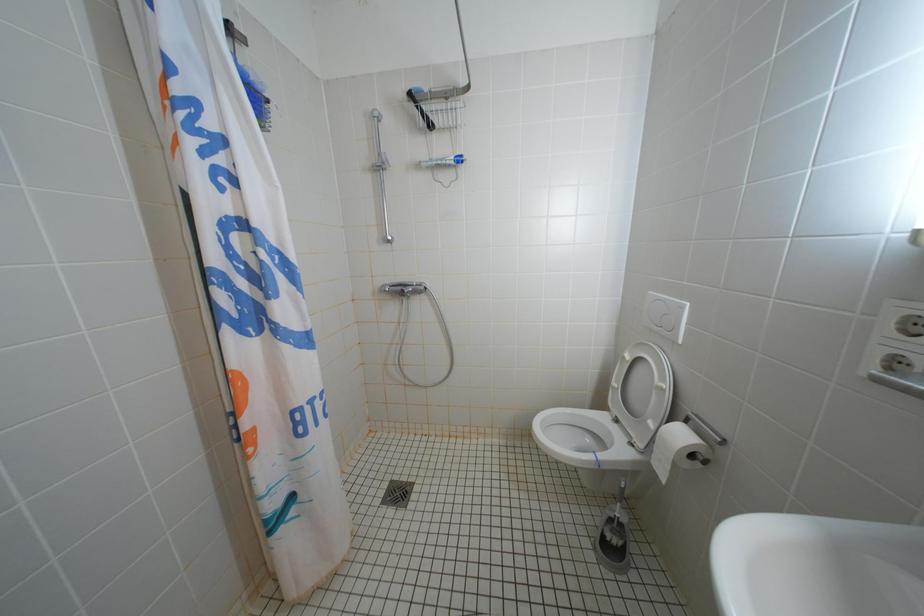
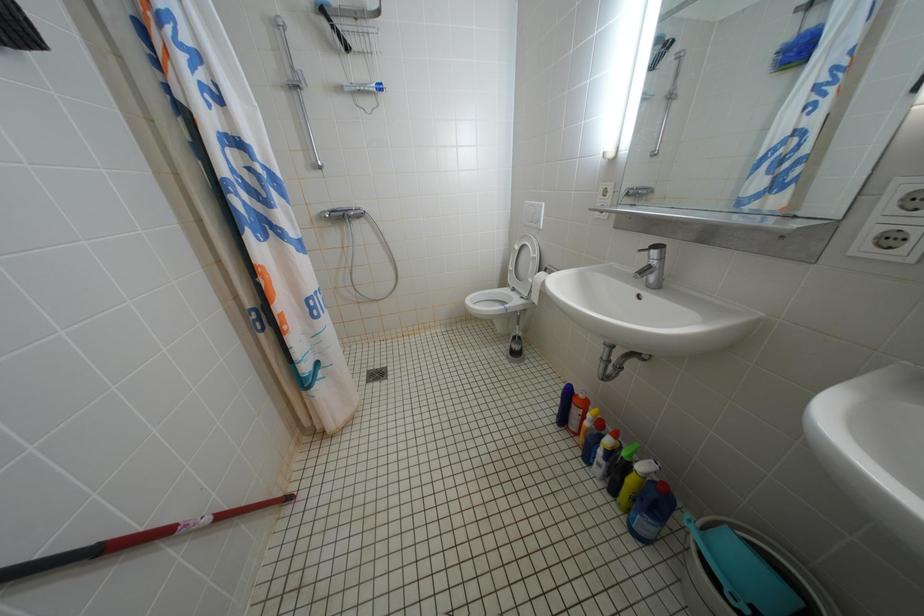
In a continuous first-person perspective shot, in which direction is the camera moving?

The cameraman walked toward left, backward.